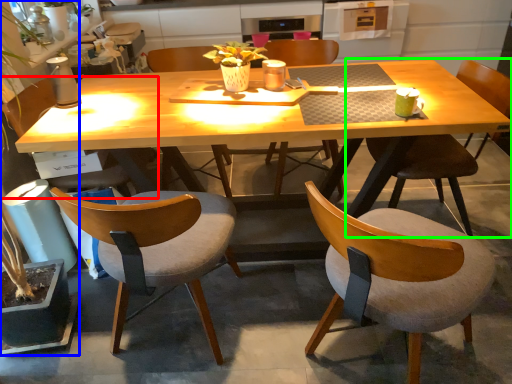
Question: Which object is positioned farthest from chair (highlighted by a red box)? Select from houseplant (highlighted by a blue box) and chair (highlighted by a green box).

Choices:
 (A) houseplant
 (B) chair

Answer: (B)